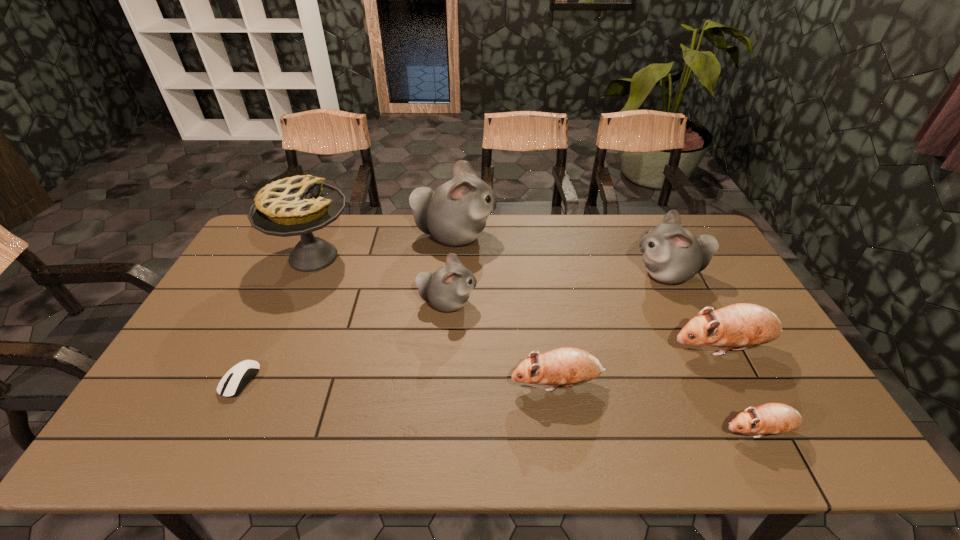
I want to click on the second shortest object, so click(x=772, y=418).

Identify the location of the nearest object. (772, 418).

You are a GUI agent. You are given a task and a screenshot of the screen. Output one action in this format:
    pyautogui.click(x=<x>, y=<y>)
    Task: Click on the white mouse
    
    Given the screenshot: What is the action you would take?
    pyautogui.click(x=234, y=381)

Identify the location of the shortest object. The image size is (960, 540). (234, 381).

This screenshot has width=960, height=540. Find the location of `vacant space located on the face of the farthest hamster`. vacant space located on the face of the farthest hamster is located at coordinates (532, 236).

The height and width of the screenshot is (540, 960). What are the coordinates of `vacant area located 0.210m on the cut side of the pie` in the screenshot? It's located at (418, 257).

The width and height of the screenshot is (960, 540). In order to click on free space located on the face of the second smallest white hamster in this screenshot , I will do `click(586, 274)`.

Find the location of a particular element. Image resolution: width=960 pixels, height=540 pixels. free space located 0.330m on the face of the second smallest white hamster is located at coordinates 531,274.

Locate an element on the screen. The height and width of the screenshot is (540, 960). free location located 0.400m on the face of the second smallest white hamster is located at coordinates (510, 274).

Identify the location of vacant space located on the face of the smallest white hamster. (540, 303).